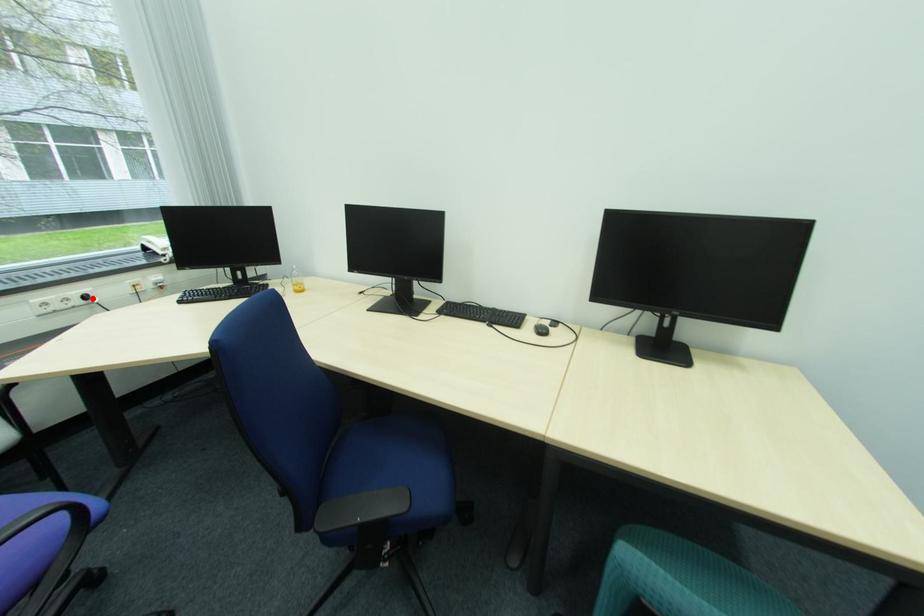
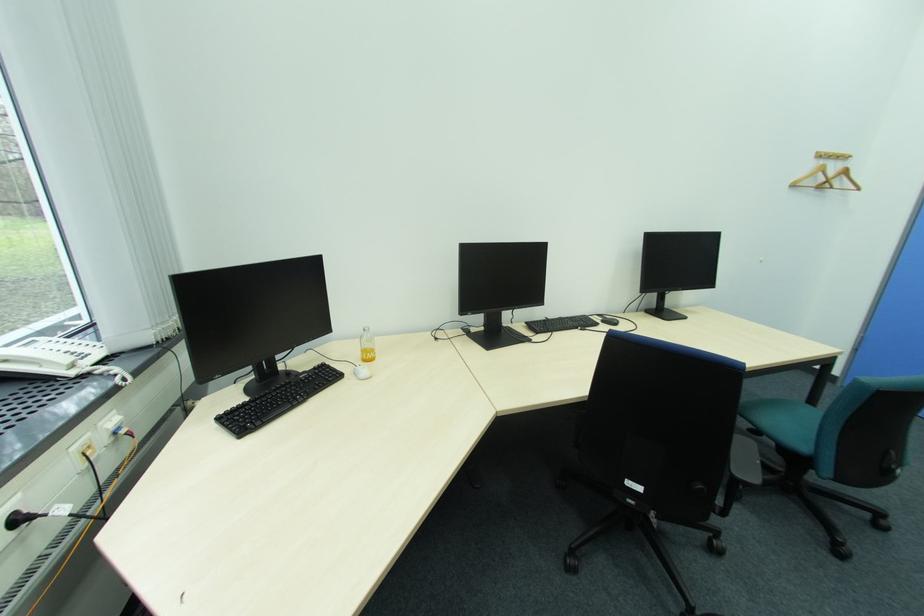
The point at the highlighted location is marked in the first image. Where is the corresponding point in the second image?

(26, 521)